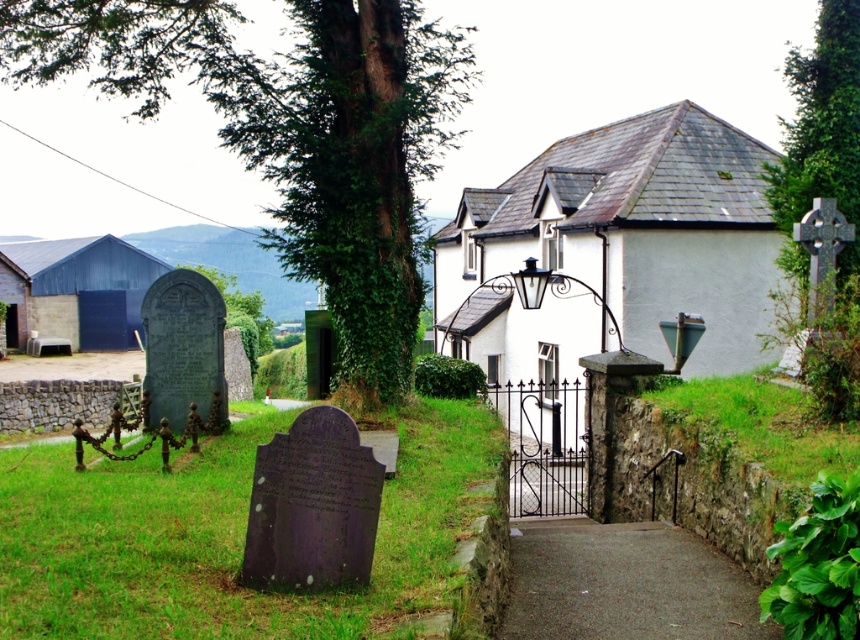
Question: Does green ivy-covered tree at center-left have a larger size compared to green ivy-covered tree at upper right?

Choices:
 (A) yes
 (B) no

Answer: (B)

Question: Which object appears closest to the camera in this image?

Choices:
 (A) green ivy-covered tree at center-left
 (B) green ivy-covered tree at upper right
 (C) gravel path at center

Answer: (C)

Question: Can you confirm if green ivy-covered tree at center-left is positioned below green ivy-covered tree at upper right?

Choices:
 (A) no
 (B) yes

Answer: (B)

Question: Which is nearer to the green ivy-covered tree at upper right?

Choices:
 (A) gravel path at center
 (B) green ivy-covered tree at center-left

Answer: (A)

Question: Which point appears farthest from the camera in this image?

Choices:
 (A) (437, 116)
 (B) (827, 144)
 (C) (510, 596)

Answer: (A)

Question: Is gravel path at center positioned at the back of green ivy-covered tree at upper right?

Choices:
 (A) no
 (B) yes

Answer: (A)